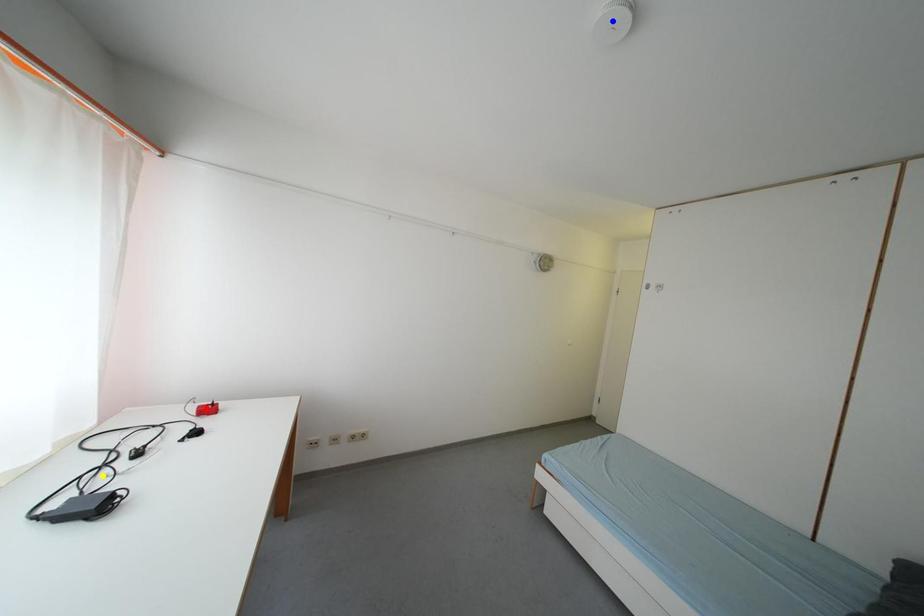
Order these from nearest to farthest:
blue point | red point | yellow point

blue point, yellow point, red point